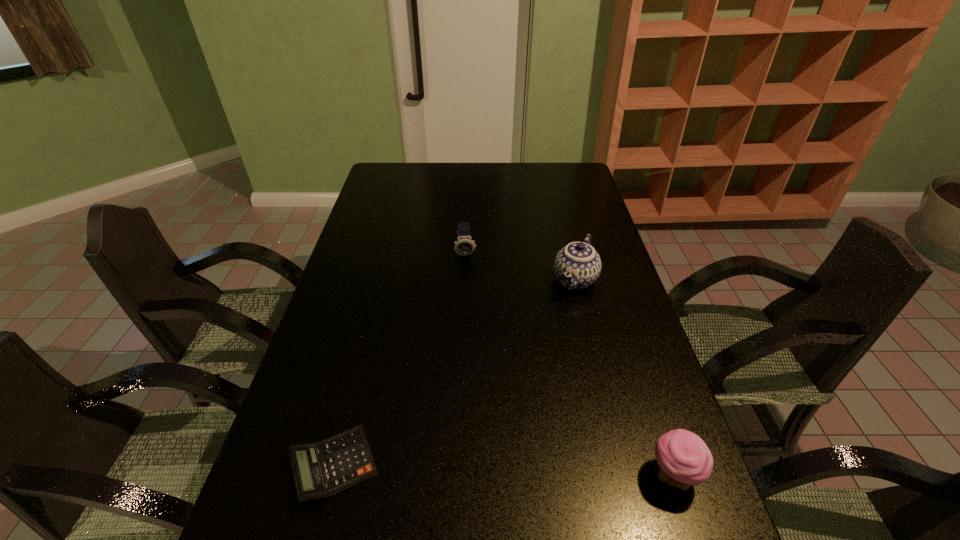
Find the location of a particular element. The width and height of the screenshot is (960, 540). free space on the desktop that is between the calculator and the cupcake and is positioned on the face of the watch is located at coordinates (482, 470).

Locate an element on the screen. The height and width of the screenshot is (540, 960). free spot on the desktop that is between the shortest object and the cupcake and is positioned from the spout of the tallest object is located at coordinates (462, 469).